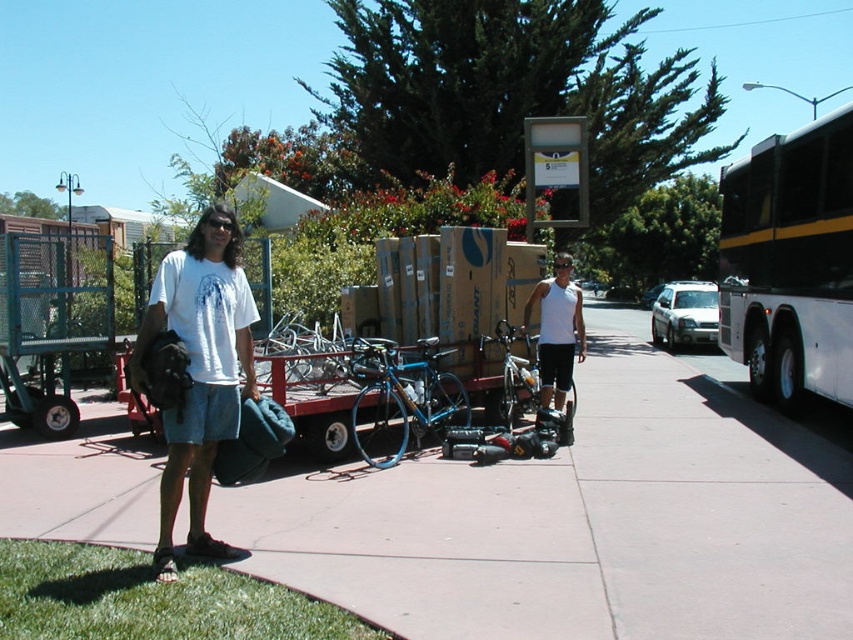
Question: From the image, what is the correct spatial relationship of black metallic bus at right in relation to white matte tank top at center?

Choices:
 (A) above
 (B) below

Answer: (A)

Question: Which of the following is the farthest from the observer?

Choices:
 (A) blue metallic bicycle at center
 (B) black metallic bus at right
 (C) smooth concrete sidewalk at center
 (D) white cotton t-shirt at left

Answer: (B)

Question: Can you confirm if black metallic bus at right is positioned below blue metallic bicycle at center?

Choices:
 (A) yes
 (B) no

Answer: (B)

Question: Is white cotton t-shirt at left thinner than blue metallic bicycle at center?

Choices:
 (A) no
 (B) yes

Answer: (B)

Question: Estimate the real-world distances between objects in this image. Which object is farther from the white cotton t-shirt at left?

Choices:
 (A) white matte tank top at center
 (B) blue metallic bicycle at center

Answer: (A)

Question: Which point is farther to the camera?

Choices:
 (A) (795, 372)
 (B) (427, 403)
 (C) (567, 339)

Answer: (A)